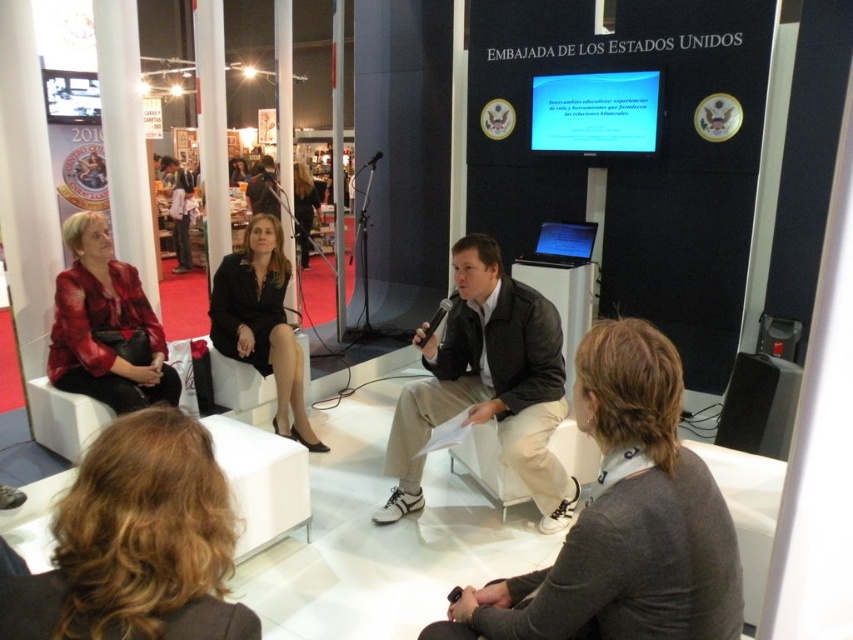
Does leather jacket at center have a larger size compared to black leather jacket at center?

No.

Can you confirm if leather jacket at center is taller than black leather jacket at center?

In fact, leather jacket at center may be shorter than black leather jacket at center.

Who is more forward, (496, 365) or (315, 193)?

Point (496, 365) is in front.

Locate an element on the screen. This screenshot has height=640, width=853. leather jacket at center is located at coordinates (486, 385).

Consider the image. Is blonde hair at lower left to the left of leather jacket at center from the viewer's perspective?

Correct, you'll find blonde hair at lower left to the left of leather jacket at center.

Who is shorter, blonde hair at lower left or leather jacket at center?

With less height is blonde hair at lower left.

The image size is (853, 640). I want to click on blonde hair at lower left, so click(x=137, y=544).

Can you confirm if leather jacket at center is smaller than black matte speaker at lower right?

No, leather jacket at center is not smaller than black matte speaker at lower right.

Between leather jacket at center and black matte speaker at lower right, which one has more height?

leather jacket at center

Who is more forward, (469, 259) or (786, 426)?

Positioned in front is point (469, 259).

What are the coordinates of `leather jacket at center` in the screenshot? It's located at (486, 385).